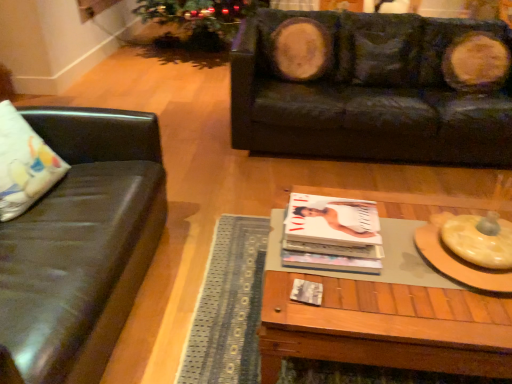
Measure the distance between matte black couch at left, the second studio couch positioned from the right, and camera.

matte black couch at left, the second studio couch positioned from the right, and camera are 3.34 feet apart from each other.

Describe the element at coordinates (82, 243) in the screenshot. The image size is (512, 384). I see `matte black couch at left, the 1th studio couch in the front-to-back sequence` at that location.

This screenshot has height=384, width=512. Describe the element at coordinates (334, 232) in the screenshot. I see `matte white magazine at center` at that location.

Locate an element on the screen. The width and height of the screenshot is (512, 384). matte white magazine at center is located at coordinates (334, 232).

Locate an element on the screen. The height and width of the screenshot is (384, 512). black leather couch at upper right, placed as the second studio couch when sorted from left to right is located at coordinates (372, 87).

From the image's perspective, is matte white magazine at center on white fabric pillow at left?

Incorrect, from the image's perspective, matte white magazine at center is lower than white fabric pillow at left.

Who is bigger, matte white magazine at center or white fabric pillow at left?

Bigger between the two is white fabric pillow at left.

What's the angular difference between white fabric pillow at left and black leather couch at upper right, which appears as the first studio couch when viewed from the back,'s facing directions?

white fabric pillow at left and black leather couch at upper right, which appears as the first studio couch when viewed from the back, are facing 86.2 degrees away from each other.

Is point (23, 176) farther from camera compared to point (234, 125)?

That is False.

Is white fabric pillow at left beside black leather couch at upper right, arranged as the first studio couch when viewed from the right?

No, white fabric pillow at left is not beside black leather couch at upper right, arranged as the first studio couch when viewed from the right.

Which point is more distant from viewer, (478,148) or (12,179)?

The point (478,148) is more distant.

Considering the positions of objects black leather couch at upper right, placed as the second studio couch when sorted from left to right, and white fabric pillow at left in the image provided, who is more to the left, black leather couch at upper right, placed as the second studio couch when sorted from left to right, or white fabric pillow at left?

Positioned to the left is white fabric pillow at left.

Can you confirm if black leather couch at upper right, which ranks as the 2th studio couch in front-to-back order, is thinner than white fabric pillow at left?

No.

From the image's perspective, between black leather couch at upper right, which appears as the first studio couch when viewed from the back, and white fabric pillow at left, which one is located above?

From the image's view, black leather couch at upper right, which appears as the first studio couch when viewed from the back, is above.

From a real-world perspective, between matte black couch at left, which is the 2th studio couch in back-to-front order, and woodenwoodencoffee table at center, who is vertically higher?

From a 3D spatial view, matte black couch at left, which is the 2th studio couch in back-to-front order, is above.

Identify the location of coffee table that appears below the matte black couch at left, arranged as the 1th studio couch when viewed from the left (from the image's perspective). The width and height of the screenshot is (512, 384). pyautogui.click(x=381, y=323).

Can woodenwoodencoffee table at center be found inside matte black couch at left, arranged as the 1th studio couch when viewed from the left?

That's incorrect, woodenwoodencoffee table at center is not inside matte black couch at left, arranged as the 1th studio couch when viewed from the left.

Is point (416, 113) closer to viewer compared to point (504, 192)?

No, (416, 113) is behind (504, 192).

Considering the sizes of objects black leather couch at upper right, placed as the second studio couch when sorted from left to right, and woodenwoodencoffee table at center in the image provided, who is wider, black leather couch at upper right, placed as the second studio couch when sorted from left to right, or woodenwoodencoffee table at center?

Wider between the two is black leather couch at upper right, placed as the second studio couch when sorted from left to right.

Is black leather couch at upper right, placed as the second studio couch when sorted from left to right, with woodenwoodencoffee table at center?

No, black leather couch at upper right, placed as the second studio couch when sorted from left to right, is not touching woodenwoodencoffee table at center.

Is woodenwoodencoffee table at center surrounded by black leather couch at upper right, which ranks as the 2th studio couch in front-to-back order?

No, woodenwoodencoffee table at center is not inside black leather couch at upper right, which ranks as the 2th studio couch in front-to-back order.

From the picture: Can you confirm if white fabric pillow at left is smaller than woodenwoodencoffee table at center?

Indeed, white fabric pillow at left has a smaller size compared to woodenwoodencoffee table at center.

Is white fabric pillow at left completely or partially outside of woodenwoodencoffee table at center?

Indeed, white fabric pillow at left is completely outside woodenwoodencoffee table at center.

Does white fabric pillow at left lie in front of woodenwoodencoffee table at center?

No, white fabric pillow at left is further to the viewer.

From a real-world perspective, which object rests below the other?

In real-world perspective, woodenwoodencoffee table at center is lower.

You are a GUI agent. You are given a task and a screenshot of the screen. Output one action in this format:
    pyautogui.click(x=<x>, y=<y>)
    Task: Click on the coffee table on the right of matte black couch at left, the 1th studio couch in the front-to-back sequence
    Image resolution: width=512 pixels, height=384 pixels.
    Given the screenshot: What is the action you would take?
    pyautogui.click(x=381, y=323)

Which object is positioned more to the right, woodenwoodencoffee table at center or matte black couch at left, the 1th studio couch in the front-to-back sequence?

Positioned to the right is woodenwoodencoffee table at center.

From a real-world perspective, is woodenwoodencoffee table at center under matte black couch at left, which is the 2th studio couch in back-to-front order?

Indeed, from a real-world perspective, woodenwoodencoffee table at center is positioned beneath matte black couch at left, which is the 2th studio couch in back-to-front order.

Is woodenwoodencoffee table at center taller or shorter than matte black couch at left, which is the 2th studio couch in back-to-front order?

woodenwoodencoffee table at center is shorter than matte black couch at left, which is the 2th studio couch in back-to-front order.

Find the location of `magazine that is below the white fabric pillow at left (from the image's perspective)`. magazine that is below the white fabric pillow at left (from the image's perspective) is located at coordinates (334, 232).

The height and width of the screenshot is (384, 512). I want to click on studio couch located behind the white fabric pillow at left, so click(x=372, y=87).

From the image, which object appears to be farther from white fabric pillow at left, woodenwoodencoffee table at center or matte white magazine at center?

woodenwoodencoffee table at center is further to white fabric pillow at left.

Based on their spatial positions, is matte white magazine at center or matte black couch at left, arranged as the 1th studio couch when viewed from the left, closer to black leather couch at upper right, which appears as the first studio couch when viewed from the back?

The object closer to black leather couch at upper right, which appears as the first studio couch when viewed from the back, is matte black couch at left, arranged as the 1th studio couch when viewed from the left.

From the image, which object appears to be farther from matte black couch at left, the 1th studio couch in the front-to-back sequence, woodenwoodencoffee table at center or matte white magazine at center?

woodenwoodencoffee table at center.

Looking at the image, which one is located closer to woodenwoodencoffee table at center, matte black couch at left, the second studio couch positioned from the right, or matte white magazine at center?

Based on the image, matte white magazine at center appears to be nearer to woodenwoodencoffee table at center.

In the scene shown: Looking at the image, which one is located further to woodenwoodencoffee table at center, matte white magazine at center or matte black couch at left, the second studio couch positioned from the right?

matte black couch at left, the second studio couch positioned from the right.

From the image, which object appears to be nearer to black leather couch at upper right, arranged as the first studio couch when viewed from the right, white fabric pillow at left or matte white magazine at center?

matte white magazine at center lies closer to black leather couch at upper right, arranged as the first studio couch when viewed from the right, than the other object.

From the image, which object appears to be nearer to black leather couch at upper right, placed as the second studio couch when sorted from left to right, white fabric pillow at left or matte black couch at left, which is the 2th studio couch in back-to-front order?

The object closer to black leather couch at upper right, placed as the second studio couch when sorted from left to right, is matte black couch at left, which is the 2th studio couch in back-to-front order.

From the image, which object appears to be farther from white fabric pillow at left, matte black couch at left, the second studio couch positioned from the right, or matte white magazine at center?

matte white magazine at center is further to white fabric pillow at left.

You are a GUI agent. You are given a task and a screenshot of the screen. Output one action in this format:
    pyautogui.click(x=<x>, y=<y>)
    Task: Click on the magazine located between white fabric pillow at left and woodenwoodencoffee table at center in the left-right direction
    
    Given the screenshot: What is the action you would take?
    pyautogui.click(x=334, y=232)

You are a GUI agent. You are given a task and a screenshot of the screen. Output one action in this format:
    pyautogui.click(x=<x>, y=<y>)
    Task: Click on the magazine between white fabric pillow at left and black leather couch at upper right, which ranks as the 2th studio couch in front-to-back order, in the horizontal direction
    
    Given the screenshot: What is the action you would take?
    pyautogui.click(x=334, y=232)

Where is `coffee table between white fabric pillow at left and black leather couch at upper right, which appears as the first studio couch when viewed from the back, in the horizontal direction`? coffee table between white fabric pillow at left and black leather couch at upper right, which appears as the first studio couch when viewed from the back, in the horizontal direction is located at coordinates (381, 323).

The width and height of the screenshot is (512, 384). In order to click on magazine between matte black couch at left, arranged as the 1th studio couch when viewed from the left, and woodenwoodencoffee table at center, in the horizontal direction in this screenshot , I will do `click(334, 232)`.